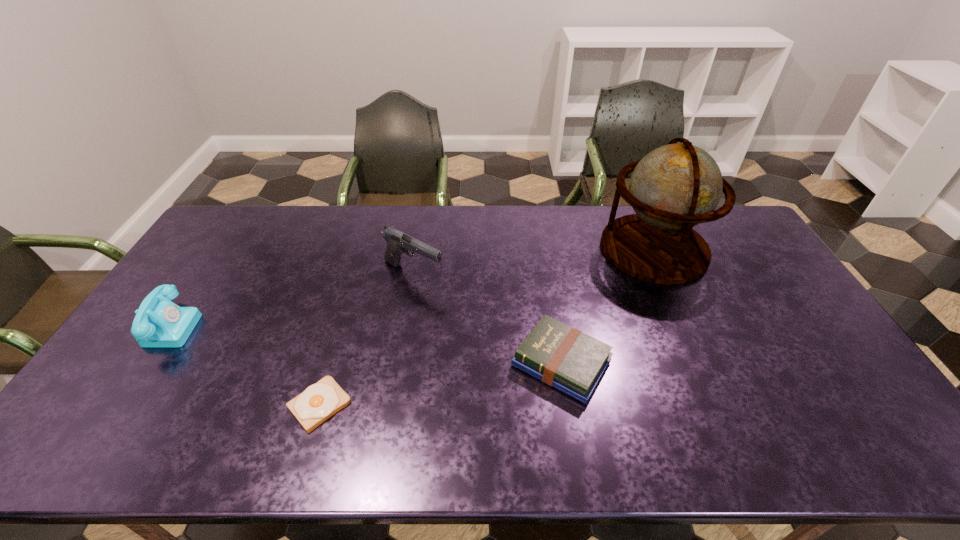
Locate an element on the screen. The width and height of the screenshot is (960, 540). the third closest object to the tallest object is located at coordinates (320, 401).

Identify the location of object that is the second closest to the leftmost object. (398, 242).

Identify the location of vacant area that satisfies the following two spatial constraints: 1. on the front-facing side of the globe; 2. at the muzzle of the gun. (665, 274).

Identify the location of free spot that satisfies the following two spatial constraints: 1. on the front-facing side of the rightmost object; 2. at the muzzle of the second tallest object. The image size is (960, 540). (665, 274).

You are a GUI agent. You are given a task and a screenshot of the screen. Output one action in this format:
    pyautogui.click(x=<x>, y=<y>)
    Task: Click on the free point that satisfies the following two spatial constraints: 1. on the dial of the third shortest object; 2. on the back side of the book
    
    Given the screenshot: What is the action you would take?
    pyautogui.click(x=144, y=363)

I want to click on free space that satisfies the following two spatial constraints: 1. on the dial of the third shortest object; 2. on the left side of the book, so click(144, 363).

You are a GUI agent. You are given a task and a screenshot of the screen. Output one action in this format:
    pyautogui.click(x=<x>, y=<y>)
    Task: Click on the free space in the image that satisfies the following two spatial constraints: 1. on the back side of the second shortest object; 2. at the muzzle of the gun
    This screenshot has width=960, height=540.
    Given the screenshot: What is the action you would take?
    pyautogui.click(x=547, y=274)

Image resolution: width=960 pixels, height=540 pixels. What are the coordinates of `free region that satisfies the following two spatial constraints: 1. on the dial of the fourth tallest object; 2. on the right side of the telephone` in the screenshot? It's located at (144, 363).

You are a GUI agent. You are given a task and a screenshot of the screen. Output one action in this format:
    pyautogui.click(x=<x>, y=<y>)
    Task: Click on the blank space that satisfies the following two spatial constraints: 1. on the dial of the leftmost object; 2. on the left side of the toast
    
    Given the screenshot: What is the action you would take?
    pyautogui.click(x=116, y=404)